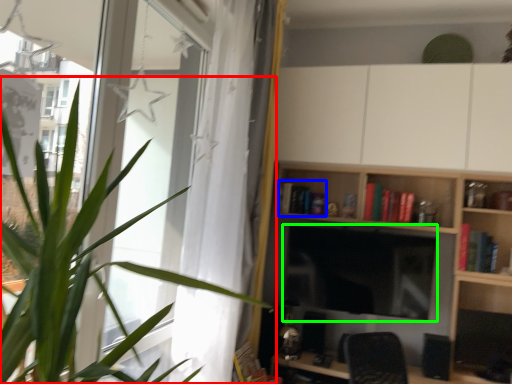
Question: Which object is the farthest from houseplant (highlighted by a red box)? Choose among these: book (highlighted by a blue box) or computer monitor (highlighted by a green box).

Choices:
 (A) book
 (B) computer monitor

Answer: (A)